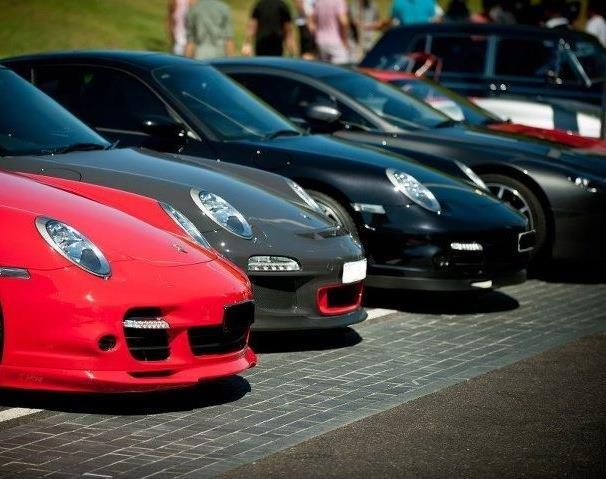
Find the location of a particular element. hoods is located at coordinates (118, 230), (253, 187), (421, 170), (524, 145).